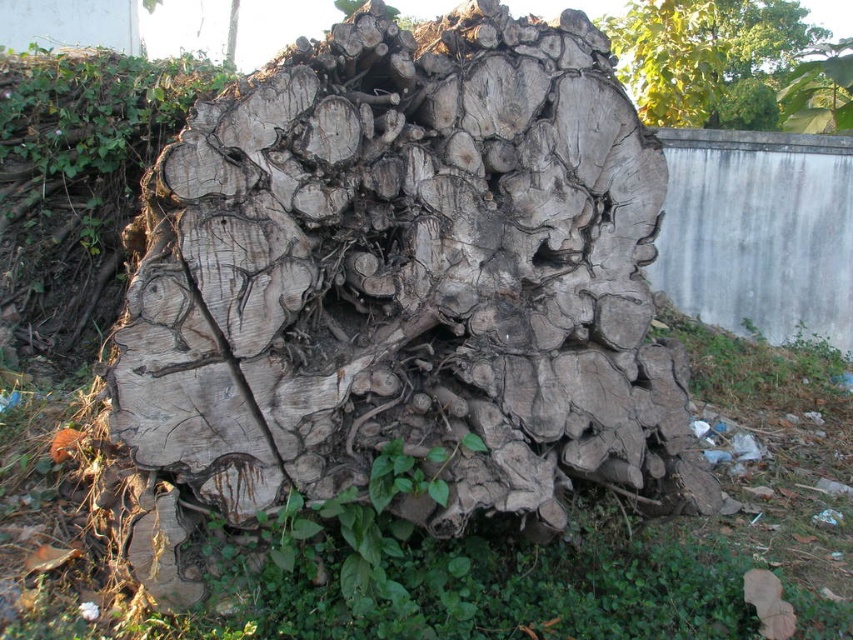
Question: Is weathered wood log at center smaller than green leafy tree at upper center?

Choices:
 (A) no
 (B) yes

Answer: (B)

Question: Does weathered wood log at center appear under green leafy tree at upper center?

Choices:
 (A) no
 (B) yes

Answer: (B)

Question: Is the position of weathered wood log at center less distant than that of green leafy tree at upper center?

Choices:
 (A) yes
 (B) no

Answer: (A)

Question: Which point appears farthest from the camera in this image?

Choices:
 (A) 729,112
 (B) 367,412

Answer: (A)

Question: Which point appears farthest from the camera in this image?

Choices:
 (A) (270, 209)
 (B) (643, 61)

Answer: (B)

Question: Which point is closer to the camera taking this photo?

Choices:
 (A) (247, 80)
 (B) (718, 77)

Answer: (A)